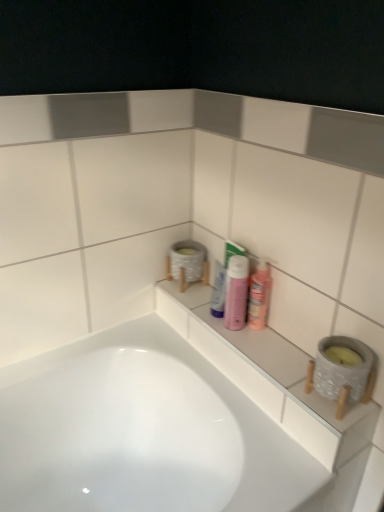
Locate an element on the screen. Image resolution: width=384 pixels, height=512 pixels. pink matte bottle at center is located at coordinates (236, 292).

Find the location of a particular element. This screenshot has width=384, height=512. white glossy tube at center, marked as the second mouthwash in a right-to-left arrangement is located at coordinates (218, 291).

Image resolution: width=384 pixels, height=512 pixels. What do you see at coordinates (218, 291) in the screenshot?
I see `white glossy tube at center, the 1th mouthwash from the left` at bounding box center [218, 291].

What is the approximate width of white ceramic ledge at center?

5.05 inches.

Locate an element on the screen. The image size is (384, 512). pink matte bottle at center is located at coordinates (236, 292).

From the image's perspective, is white glossy tube at center, marked as the second mouthwash in a right-to-left arrangement, below white ceramic ledge at center?

Actually, white glossy tube at center, marked as the second mouthwash in a right-to-left arrangement, appears above white ceramic ledge at center in the image.

Locate an element on the screen. The height and width of the screenshot is (512, 384). mouthwash that is the 2nd one when counting backward from the white ceramic ledge at center is located at coordinates (218, 291).

Does white glossy tube at center, the 1th mouthwash from the left, have a greater height compared to white ceramic ledge at center?

Yes.

Does white glossy tube at center, the 1th mouthwash from the left, have a lesser width compared to white ceramic ledge at center?

Indeed, white glossy tube at center, the 1th mouthwash from the left, has a lesser width compared to white ceramic ledge at center.

Is white ceramic ledge at center touching white glossy tube at center, marked as the second mouthwash in a right-to-left arrangement?

No, white ceramic ledge at center is not making contact with white glossy tube at center, marked as the second mouthwash in a right-to-left arrangement.

From a real-world perspective, is white ceramic ledge at center above or below white glossy tube at center, the 1th mouthwash from the left?

From a real-world perspective, white ceramic ledge at center is physically below white glossy tube at center, the 1th mouthwash from the left.

From a real-world perspective, is pink matte bottle at center over pink glossy mouthwash at center, arranged as the first mouthwash when viewed from the right?

Actually, pink matte bottle at center is physically below pink glossy mouthwash at center, arranged as the first mouthwash when viewed from the right, in the real world.

Considering the positions of point (243, 272) and point (266, 311), is point (243, 272) closer or farther from the camera than point (266, 311)?

Point (243, 272).

Between pink matte bottle at center and pink glossy mouthwash at center, which is the second mouthwash in left-to-right order, which one has smaller width?

Thinner between the two is pink glossy mouthwash at center, which is the second mouthwash in left-to-right order.

Is pink matte bottle at center smaller than pink glossy mouthwash at center, which is the second mouthwash in left-to-right order?

No.

Is white ceramic ledge at center at the back of pink matte bottle at center?

No.

From the image's perspective, is pink matte bottle at center positioned above or below white ceramic ledge at center?

pink matte bottle at center is situated higher than white ceramic ledge at center in the image.

Can white ceramic ledge at center be found inside pink matte bottle at center?

That's incorrect, white ceramic ledge at center is not inside pink matte bottle at center.

Consider the image. Is the depth of pink matte bottle at center less than that of white ceramic ledge at center?

No, pink matte bottle at center is further to the viewer.

Measure the distance between pink glossy mouthwash at center, which is the second mouthwash in left-to-right order, and white glossy tube at center, the 1th mouthwash from the left.

A distance of 4.84 inches exists between pink glossy mouthwash at center, which is the second mouthwash in left-to-right order, and white glossy tube at center, the 1th mouthwash from the left.

Is pink glossy mouthwash at center, arranged as the first mouthwash when viewed from the right, not within white glossy tube at center, the 1th mouthwash from the left?

Yes, pink glossy mouthwash at center, arranged as the first mouthwash when viewed from the right, is outside of white glossy tube at center, the 1th mouthwash from the left.

Considering the sizes of objects pink glossy mouthwash at center, arranged as the first mouthwash when viewed from the right, and white glossy tube at center, marked as the second mouthwash in a right-to-left arrangement, in the image provided, who is wider, pink glossy mouthwash at center, arranged as the first mouthwash when viewed from the right, or white glossy tube at center, marked as the second mouthwash in a right-to-left arrangement,?

Wider between the two is pink glossy mouthwash at center, arranged as the first mouthwash when viewed from the right.

Is pink glossy mouthwash at center, which is the second mouthwash in left-to-right order, far away from white glossy tube at center, the 1th mouthwash from the left?

No, pink glossy mouthwash at center, which is the second mouthwash in left-to-right order, is not far from white glossy tube at center, the 1th mouthwash from the left.

From the image's perspective, between white ceramic ledge at center and pink glossy mouthwash at center, which is the second mouthwash in left-to-right order, who is located below?

From the image's view, white ceramic ledge at center is below.

Based on the photo, what's the angular difference between white ceramic ledge at center and pink glossy mouthwash at center, which is the second mouthwash in left-to-right order,'s facing directions?

They differ by 0.508 degrees in their facing directions.

Is white ceramic ledge at center not close to pink glossy mouthwash at center, which is the second mouthwash in left-to-right order?

They are positioned close to each other.

Between point (292, 426) and point (257, 311), which one is positioned behind?

Positioned behind is point (257, 311).

Where is `ledge lying in front of the pink glossy mouthwash at center, which is the second mouthwash in left-to-right order`? The width and height of the screenshot is (384, 512). ledge lying in front of the pink glossy mouthwash at center, which is the second mouthwash in left-to-right order is located at coordinates (269, 376).

Which object is closer to the camera, pink glossy mouthwash at center, arranged as the first mouthwash when viewed from the right, or white ceramic ledge at center?

Positioned in front is white ceramic ledge at center.

Looking at their sizes, would you say pink glossy mouthwash at center, arranged as the first mouthwash when viewed from the right, is wider or thinner than white ceramic ledge at center?

Clearly, pink glossy mouthwash at center, arranged as the first mouthwash when viewed from the right, has less width compared to white ceramic ledge at center.

From the image's perspective, which object appears higher, pink glossy mouthwash at center, which is the second mouthwash in left-to-right order, or white ceramic ledge at center?

pink glossy mouthwash at center, which is the second mouthwash in left-to-right order, appears higher in the image.

From a real-world perspective, which mouthwash is the 1st one above the white ceramic ledge at center? Please provide its 2D coordinates.

[(218, 291)]

Locate an element on the screen. mouthwash that is the 2nd object located behind the white ceramic ledge at center is located at coordinates (218, 291).

From the image, which object appears to be nearer to pink matte bottle at center, white ceramic ledge at center or white glossy tube at center, the 1th mouthwash from the left?

white glossy tube at center, the 1th mouthwash from the left, is closer to pink matte bottle at center.

Which object lies nearer to the anchor point white glossy tube at center, marked as the second mouthwash in a right-to-left arrangement, pink glossy mouthwash at center, arranged as the first mouthwash when viewed from the right, or white ceramic ledge at center?

pink glossy mouthwash at center, arranged as the first mouthwash when viewed from the right.

Estimate the real-world distances between objects in this image. Which object is further from white glossy tube at center, the 1th mouthwash from the left, pink glossy mouthwash at center, which is the second mouthwash in left-to-right order, or pink matte bottle at center?

The object further to white glossy tube at center, the 1th mouthwash from the left, is pink glossy mouthwash at center, which is the second mouthwash in left-to-right order.

From the image, which object appears to be farther from white ceramic ledge at center, white glossy tube at center, the 1th mouthwash from the left, or pink glossy mouthwash at center, which is the second mouthwash in left-to-right order?

white glossy tube at center, the 1th mouthwash from the left.

Estimate the real-world distances between objects in this image. Which object is closer to pink matte bottle at center, pink glossy mouthwash at center, arranged as the first mouthwash when viewed from the right, or white glossy tube at center, marked as the second mouthwash in a right-to-left arrangement?

pink glossy mouthwash at center, arranged as the first mouthwash when viewed from the right, is positioned closer to the anchor pink matte bottle at center.

Which object lies further to the anchor point pink glossy mouthwash at center, which is the second mouthwash in left-to-right order, white ceramic ledge at center or pink matte bottle at center?

The object further to pink glossy mouthwash at center, which is the second mouthwash in left-to-right order, is white ceramic ledge at center.

Which object lies nearer to the anchor point white glossy tube at center, the 1th mouthwash from the left, pink matte bottle at center or white ceramic ledge at center?

pink matte bottle at center lies closer to white glossy tube at center, the 1th mouthwash from the left, than the other object.

Based on their spatial positions, is white glossy tube at center, the 1th mouthwash from the left, or pink matte bottle at center further from white ceramic ledge at center?

Among the two, white glossy tube at center, the 1th mouthwash from the left, is located further to white ceramic ledge at center.

Locate an element on the screen. Image resolution: width=384 pixels, height=512 pixels. mouthwash between white ceramic ledge at center and white glossy tube at center, marked as the second mouthwash in a right-to-left arrangement, in the front-back direction is located at coordinates 259,296.

At what (x,y) coordinates should I click in order to perform the action: click on toiletry between white ceramic ledge at center and white glossy tube at center, marked as the second mouthwash in a right-to-left arrangement, from front to back. Please return your answer as a coordinate pair (x, y). Looking at the image, I should click on (236, 292).

The height and width of the screenshot is (512, 384). In order to click on toiletry between white glossy tube at center, marked as the second mouthwash in a right-to-left arrangement, and pink glossy mouthwash at center, arranged as the first mouthwash when viewed from the right, in the horizontal direction in this screenshot , I will do `click(236, 292)`.

Image resolution: width=384 pixels, height=512 pixels. I want to click on toiletry between white ceramic ledge at center and pink glossy mouthwash at center, arranged as the first mouthwash when viewed from the right, along the z-axis, so click(x=236, y=292).